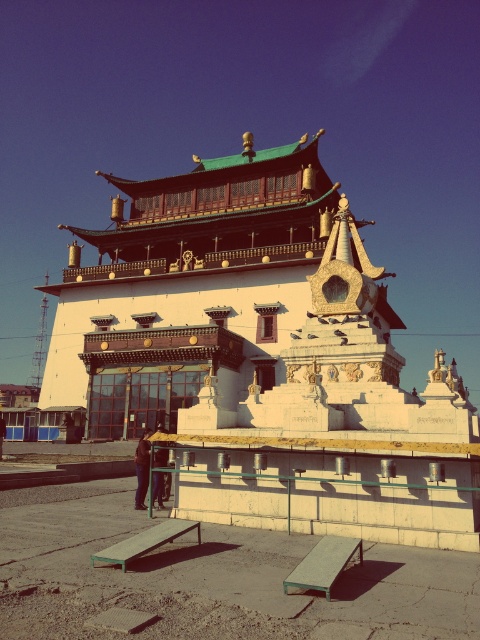
From the picture: Does green painted wood picnic table at lower center have a lesser width compared to dark brown leather jacket at lower center?

Yes, green painted wood picnic table at lower center is thinner than dark brown leather jacket at lower center.

Is point (300, 564) farther from camera compared to point (134, 502)?

No.

What do you see at coordinates (324, 563) in the screenshot? I see `green painted wood picnic table at lower center` at bounding box center [324, 563].

Where is `green painted wood picnic table at lower center`? Image resolution: width=480 pixels, height=640 pixels. green painted wood picnic table at lower center is located at coordinates (324, 563).

How much distance is there between green painted wood picnic table at lower center and green matte picnic table at lower center?

The distance of green painted wood picnic table at lower center from green matte picnic table at lower center is 6.41 meters.

Can you confirm if green painted wood picnic table at lower center is positioned below green matte picnic table at lower center?

No.

Which is in front, point (299, 579) or point (130, 560)?

Point (299, 579)

In order to click on green painted wood picnic table at lower center in this screenshot , I will do `click(324, 563)`.

Does green matte picnic table at lower center appear on the right side of dark brown leather jacket at lower center?

Correct, you'll find green matte picnic table at lower center to the right of dark brown leather jacket at lower center.

Which is in front, point (177, 531) or point (134, 461)?

Point (177, 531) is more forward.

You are a GUI agent. You are given a task and a screenshot of the screen. Output one action in this format:
    pyautogui.click(x=<x>, y=<y>)
    Task: Click on the green matte picnic table at lower center
    The width and height of the screenshot is (480, 640).
    Given the screenshot: What is the action you would take?
    pyautogui.click(x=144, y=541)